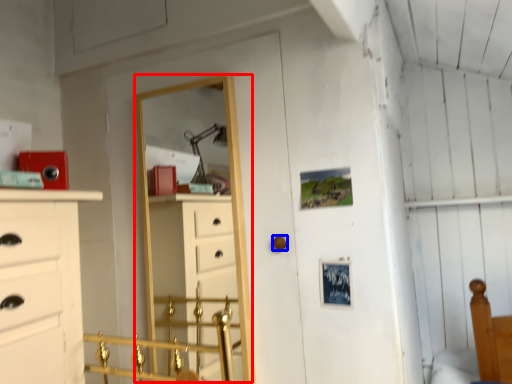
Question: Among these objects, which one is farthest to the camera, mirror (highlighted by a red box) or door handle (highlighted by a blue box)?

Choices:
 (A) mirror
 (B) door handle

Answer: (A)